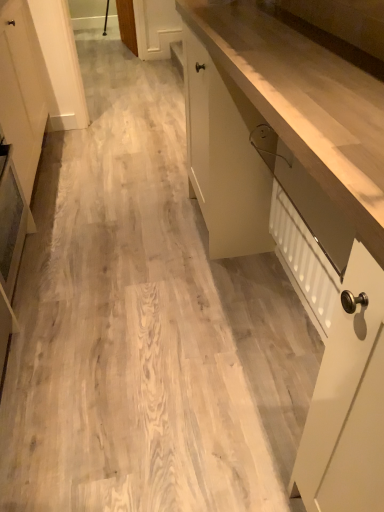
You are a GUI agent. You are given a task and a screenshot of the screen. Output one action in this format:
    pyautogui.click(x=<x>, y=<y>)
    Task: Click on the blank area to the left of white matte cabinet at right
    
    Given the screenshot: What is the action you would take?
    pyautogui.click(x=120, y=312)